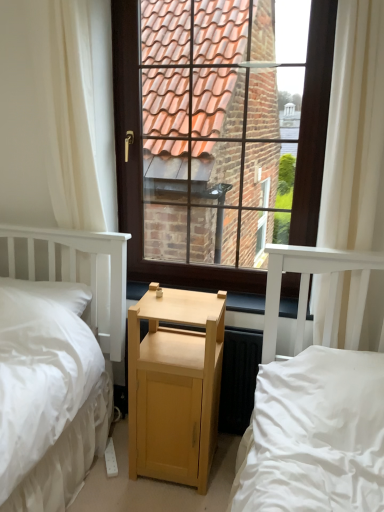
Question: From the image's perspective, relative to brown wooden window at center, is white soft pillow at left above or below?

Choices:
 (A) below
 (B) above

Answer: (A)

Question: Is white soft pillow at left wider or thinner than brown wooden window at center?

Choices:
 (A) thin
 (B) wide

Answer: (B)

Question: Based on their relative distances, which object is farther from the white sheer curtain at upper right, arranged as the first curtain when viewed from the right?

Choices:
 (A) light wood bed at center
 (B) white sheer curtain at left, the 1th curtain viewed from the left
 (C) brown wooden window at center
 (D) light wood nightstand at center
 (E) wooden at center

Answer: (C)

Question: Which is nearer to the white soft pillow at left?

Choices:
 (A) light wood nightstand at center
 (B) white sheer curtain at left, the 1th curtain viewed from the left
 (C) wooden at center
 (D) brown wooden window at center
 (E) white sheer curtain at upper right, the 2th curtain from the left

Answer: (A)